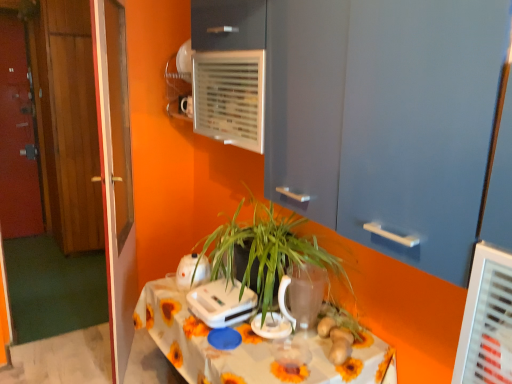
Image resolution: width=512 pixels, height=384 pixels. In order to click on free spot in front of white plastic appliance at center, the 2th appliance positioned from the right in this screenshot , I will do `click(227, 347)`.